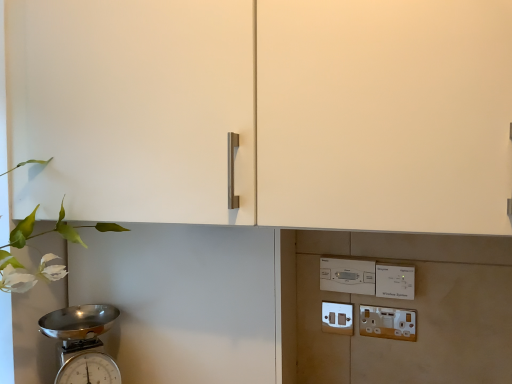
Question: Is white plastic light switch at center, which is the second light switch in right-to-left order, smaller than shiny metallic scale at lower left?

Choices:
 (A) no
 (B) yes

Answer: (B)

Question: Does white plastic light switch at center, which is the second light switch in right-to-left order, appear on the right side of shiny metallic scale at lower left?

Choices:
 (A) no
 (B) yes

Answer: (B)

Question: Considering the relative sizes of white plastic light switch at center, which is the second light switch in right-to-left order, and shiny metallic scale at lower left in the image provided, is white plastic light switch at center, which is the second light switch in right-to-left order, shorter than shiny metallic scale at lower left?

Choices:
 (A) no
 (B) yes

Answer: (B)

Question: From the image's perspective, is white plastic light switch at center, which is counted as the first light switch, starting from the left, on shiny metallic scale at lower left?

Choices:
 (A) yes
 (B) no

Answer: (A)

Question: Is white plastic light switch at center, which is the second light switch in right-to-left order, outside shiny metallic scale at lower left?

Choices:
 (A) no
 (B) yes

Answer: (B)

Question: Is the position of white plastic light switch at center, which is the second light switch in right-to-left order, more distant than that of shiny metallic scale at lower left?

Choices:
 (A) no
 (B) yes

Answer: (B)

Question: Is white plastic electric outlet at lower right, marked as the 1th electric outlet in a right-to-left arrangement, thinner than matte white switch at lower center, which appears as the 2th electric outlet when viewed from the right?

Choices:
 (A) yes
 (B) no

Answer: (A)

Question: From the image's perspective, is white plastic electric outlet at lower right, arranged as the 2th electric outlet when viewed from the back, located beneath matte white switch at lower center, the first electric outlet in the back-to-front sequence?

Choices:
 (A) no
 (B) yes

Answer: (B)

Question: Is white plastic electric outlet at lower right, positioned as the 1th electric outlet in front-to-back order, positioned far away from matte white switch at lower center, which appears as the 2th electric outlet when viewed from the right?

Choices:
 (A) no
 (B) yes

Answer: (A)

Question: Is white plastic electric outlet at lower right, which is the second electric outlet in left-to-right order, aimed at matte white switch at lower center, which is the 1th electric outlet from left to right?

Choices:
 (A) yes
 (B) no

Answer: (B)

Question: Considering the relative sizes of white plastic electric outlet at lower right, which is the second electric outlet in left-to-right order, and matte white switch at lower center, the first electric outlet in the back-to-front sequence, in the image provided, is white plastic electric outlet at lower right, which is the second electric outlet in left-to-right order, bigger than matte white switch at lower center, the first electric outlet in the back-to-front sequence,?

Choices:
 (A) yes
 (B) no

Answer: (A)

Question: Is white plastic electric outlet at lower right, which is the second electric outlet in left-to-right order, turned away from matte white switch at lower center, which is the 1th electric outlet from left to right?

Choices:
 (A) yes
 (B) no

Answer: (B)

Question: Can white plastic light switch at center, which is counted as the first light switch, starting from the left, be found inside white plastic light switch at lower right, the first light switch positioned from the right?

Choices:
 (A) yes
 (B) no

Answer: (B)